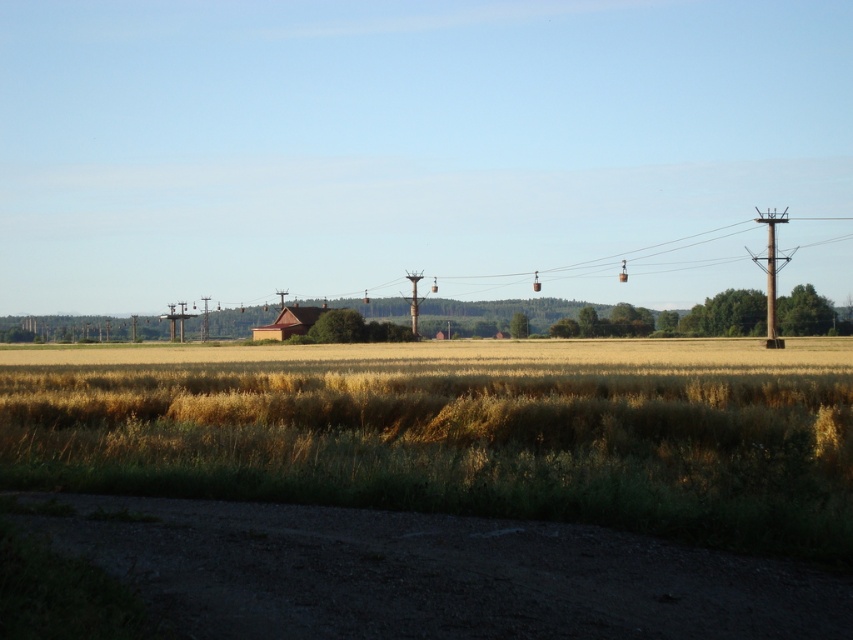
You are a farmer checking the height of your crops and infrastructure. You have the yellow grassy wheat field at center and the metallic gray telegraph pole at center in view. Which one is taller?

The metallic gray telegraph pole at center is taller than the yellow grassy wheat field at center.

You are standing on the dirt road in the rural landscape and see the brown wooden telegraph pole at right. If you want to reach the red roofed building in the distance, which direction should you walk relative to the telegraph pole?

The brown wooden telegraph pole at right is 69.30 meters away from the viewer. Since the red roofed building is located towards the horizon beyond the fields, you should walk away from the telegraph pole towards the fields to reach it.